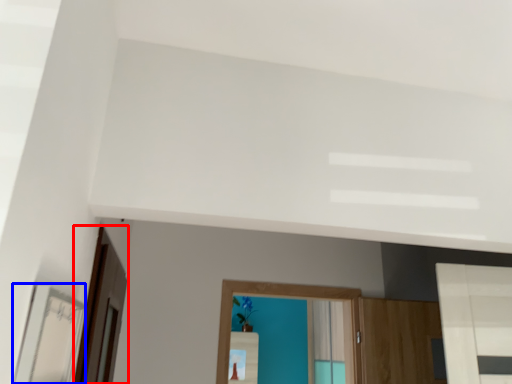
Question: Which object appears closest to the camera in this image, screen door (highlighted by a red box) or mirror (highlighted by a blue box)?

Choices:
 (A) screen door
 (B) mirror

Answer: (B)